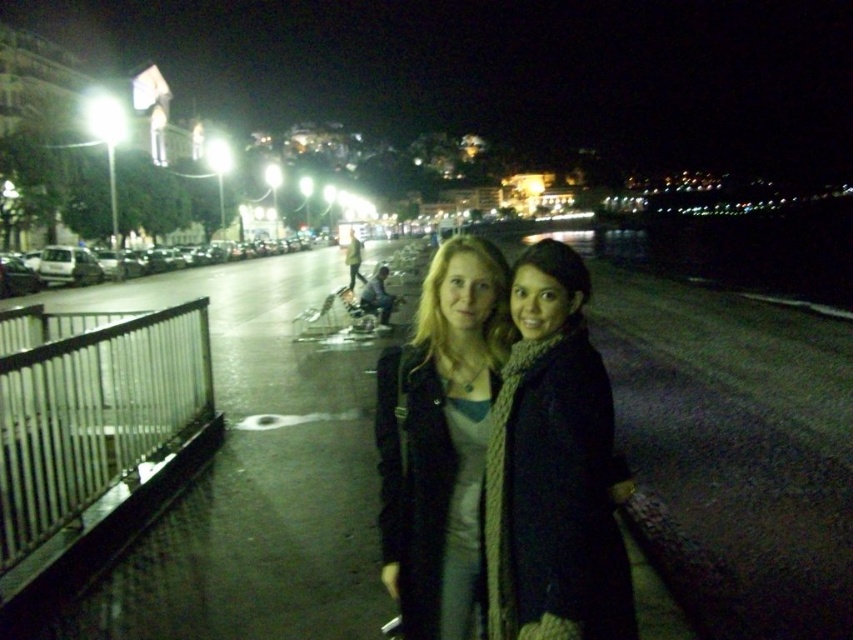
Question: Observing the image, what is the correct spatial positioning of knitted beige scarf at center in reference to knitted scarf at center?

Choices:
 (A) below
 (B) above

Answer: (B)

Question: Can you confirm if knitted beige scarf at center is positioned to the left of knitted scarf at center?

Choices:
 (A) no
 (B) yes

Answer: (A)

Question: From the image, what is the correct spatial relationship of knitted beige scarf at center in relation to knitted scarf at center?

Choices:
 (A) left
 (B) right

Answer: (B)